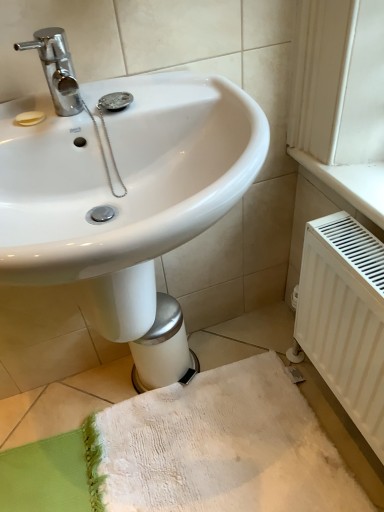
What do you see at coordinates (345, 317) in the screenshot? I see `white matte radiator at lower right` at bounding box center [345, 317].

Measure the distance between point (362, 364) and camera.

Point (362, 364) is 33.90 inches away from camera.

Where is `white matte radiator at lower right`? The height and width of the screenshot is (512, 384). white matte radiator at lower right is located at coordinates (345, 317).

Where is `white textured bath towel at lower center`? The image size is (384, 512). white textured bath towel at lower center is located at coordinates (218, 448).

In order to face white textured bath towel at lower center, should I rotate leftwards or rightwards?

To face it directly, rotate right by 2.416 degrees.

Describe the element at coordinates (218, 448) in the screenshot. The width and height of the screenshot is (384, 512). I see `white textured bath towel at lower center` at that location.

Where is `white matte radiator at lower right`? Image resolution: width=384 pixels, height=512 pixels. white matte radiator at lower right is located at coordinates (345, 317).

Is white textured bath towel at lower center to the left of white matte radiator at lower right from the viewer's perspective?

Correct, you'll find white textured bath towel at lower center to the left of white matte radiator at lower right.

Relative to white matte radiator at lower right, is white textured bath towel at lower center in front or behind?

In the image, white textured bath towel at lower center appears behind white matte radiator at lower right.

Is point (250, 442) closer or farther from the camera than point (365, 230)?

Point (250, 442).

From the image's perspective, between white textured bath towel at lower center and white matte radiator at lower right, who is located below?

white textured bath towel at lower center appears lower in the image.

From a real-world perspective, is white textured bath towel at lower center positioned over white matte radiator at lower right based on gravity?

Incorrect, from a real-world perspective, white textured bath towel at lower center is lower than white matte radiator at lower right.

Does white textured bath towel at lower center have a lesser width compared to white matte radiator at lower right?

Incorrect, the width of white textured bath towel at lower center is not less than that of white matte radiator at lower right.

Considering the relative sizes of white textured bath towel at lower center and white matte radiator at lower right in the image provided, is white textured bath towel at lower center taller than white matte radiator at lower right?

No.

Can you confirm if white textured bath towel at lower center is smaller than white matte radiator at lower right?

Indeed, white textured bath towel at lower center has a smaller size compared to white matte radiator at lower right.

Is white textured bath towel at lower center inside or outside of white matte radiator at lower right?

white textured bath towel at lower center is not enclosed by white matte radiator at lower right.

Would you say white textured bath towel at lower center is a long distance from white matte radiator at lower right?

No, white textured bath towel at lower center is not far away from white matte radiator at lower right.

Is white textured bath towel at lower center aimed at white matte radiator at lower right?

No, white textured bath towel at lower center is not aimed at white matte radiator at lower right.

How different are the orientations of white textured bath towel at lower center and white matte radiator at lower right in degrees?

The angular difference between white textured bath towel at lower center and white matte radiator at lower right is 0.305 degrees.

How distant is white textured bath towel at lower center from white matte radiator at lower right?

14.71 inches.

This screenshot has width=384, height=512. Find the location of `radiator positioned vertically above the white textured bath towel at lower center (from a real-world perspective)`. radiator positioned vertically above the white textured bath towel at lower center (from a real-world perspective) is located at coordinates (345, 317).

Is white matte radiator at lower right to the left of white textured bath towel at lower center from the viewer's perspective?

No.

Is white matte radiator at lower right positioned in front of white textured bath towel at lower center?

Yes, white matte radiator at lower right is closer to the camera.

Considering the positions of point (351, 284) and point (352, 482), is point (351, 284) closer or farther from the camera than point (352, 482)?

Point (351, 284) is positioned closer to the camera compared to point (352, 482).

From the image's perspective, which one is positioned lower, white matte radiator at lower right or white textured bath towel at lower center?

white textured bath towel at lower center appears lower in the image.

From a real-world perspective, is white matte radiator at lower right located beneath white textured bath towel at lower center?

No.

In terms of width, does white matte radiator at lower right look wider or thinner when compared to white textured bath towel at lower center?

Clearly, white matte radiator at lower right has less width compared to white textured bath towel at lower center.

Considering the sizes of white matte radiator at lower right and white textured bath towel at lower center in the image, is white matte radiator at lower right taller or shorter than white textured bath towel at lower center?

In the image, white matte radiator at lower right appears to be taller than white textured bath towel at lower center.

Which of these two, white matte radiator at lower right or white textured bath towel at lower center, is smaller?

white textured bath towel at lower center.

From the picture: Is white textured bath towel at lower center located within white matte radiator at lower right?

That's incorrect, white textured bath towel at lower center is not inside white matte radiator at lower right.

Are white matte radiator at lower right and white textured bath towel at lower center far apart?

No, white matte radiator at lower right is not far away from white textured bath towel at lower center.

Is white matte radiator at lower right facing away from white textured bath towel at lower center?

white matte radiator at lower right is not turned away from white textured bath towel at lower center.

In the scene shown: Measure the distance from white matte radiator at lower right to white textured bath towel at lower center.

white matte radiator at lower right is 14.71 inches away from white textured bath towel at lower center.

Locate an element on the screen. Image resolution: width=384 pixels, height=512 pixels. bath towel on the left of white matte radiator at lower right is located at coordinates (218, 448).

The width and height of the screenshot is (384, 512). What are the coordinates of `bath towel below the white matte radiator at lower right (from the image's perspective)` in the screenshot? It's located at (218, 448).

The height and width of the screenshot is (512, 384). What are the coordinates of `radiator to the right of white textured bath towel at lower center` in the screenshot? It's located at (345, 317).